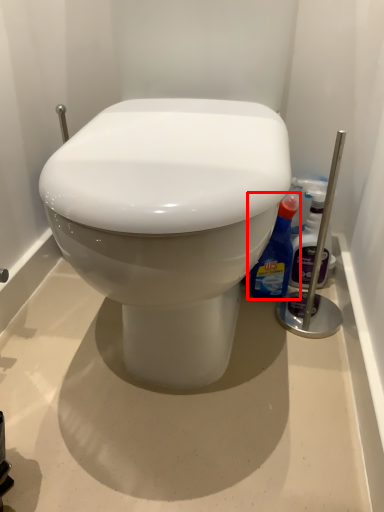
Question: In this image, where is cleaning product (annotated by the red box) located relative to cleaning product?

Choices:
 (A) left
 (B) right

Answer: (A)